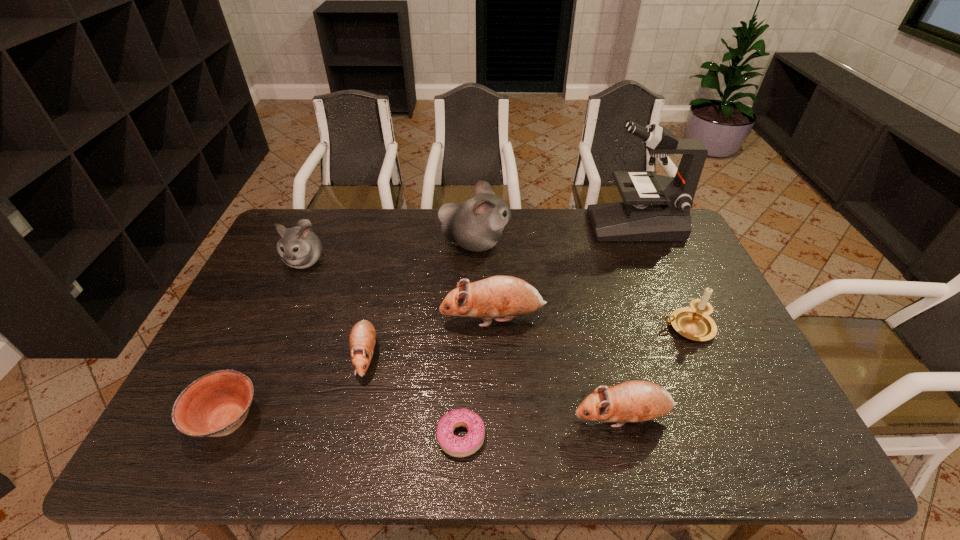
Image resolution: width=960 pixels, height=540 pixels. I want to click on vacant point located between the second shortest hamster and the third object from left to right, so [494, 387].

Locate an element on the screen. free spot between the third object from left to right and the bowl is located at coordinates (297, 388).

What are the coordinates of `vacant space that's between the tallest object and the beige candle holder` in the screenshot? It's located at 661,276.

The width and height of the screenshot is (960, 540). I want to click on free space between the candle holder and the tallest object, so click(661, 276).

What are the coordinates of `free space between the microscope and the second shortest hamster` in the screenshot? It's located at (629, 321).

Where is `free space between the second hamster from left to right and the beige candle holder`? Image resolution: width=960 pixels, height=540 pixels. free space between the second hamster from left to right and the beige candle holder is located at coordinates (526, 341).

Identify which object is the seventh closest to the smaller white hamster. Please provide its 2D coordinates. Your answer should be formatted as a tuple, i.e. [(x, y)], where the tuple contains the x and y coordinates of a point satisfying the conditions above.

[(658, 209)]

Choose which object is the fifth nearest neighbor to the bowl. Please provide its 2D coordinates. Your answer should be formatted as a tuple, i.e. [(x, y)], where the tuple contains the x and y coordinates of a point satisfying the conditions above.

[(476, 225)]

Locate an element on the screen. The height and width of the screenshot is (540, 960). hamster that can be found as the closest to the doughnut is located at coordinates point(362,339).

Find the location of `the second closest hamster relative to the second shortest hamster`. the second closest hamster relative to the second shortest hamster is located at coordinates (362, 339).